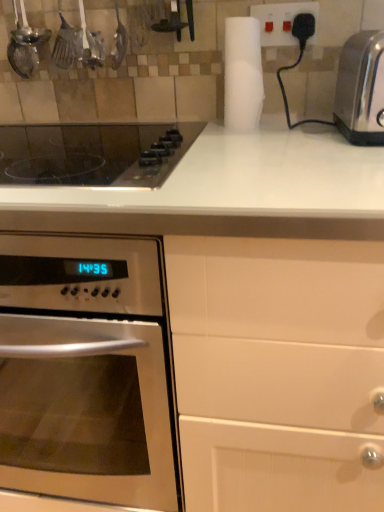
Question: Is satin silver toaster at right to the right of white matte paper towel at upper center from the viewer's perspective?

Choices:
 (A) yes
 (B) no

Answer: (A)

Question: Is satin silver toaster at right positioned far away from white matte paper towel at upper center?

Choices:
 (A) no
 (B) yes

Answer: (A)

Question: Does satin silver toaster at right have a lesser width compared to white matte paper towel at upper center?

Choices:
 (A) yes
 (B) no

Answer: (B)

Question: Is the position of satin silver toaster at right more distant than that of white matte paper towel at upper center?

Choices:
 (A) no
 (B) yes

Answer: (A)

Question: Can you confirm if satin silver toaster at right is shorter than white matte paper towel at upper center?

Choices:
 (A) yes
 (B) no

Answer: (A)

Question: From the image's perspective, relative to white plastic plug at upper right, is satin silver oven at left above or below?

Choices:
 (A) below
 (B) above

Answer: (A)

Question: In the image, is satin silver oven at left positioned in front of or behind white plastic plug at upper right?

Choices:
 (A) behind
 (B) front

Answer: (B)

Question: In the image, is satin silver oven at left on the left side or the right side of white plastic plug at upper right?

Choices:
 (A) right
 (B) left

Answer: (B)

Question: Is satin silver oven at left wider or thinner than white plastic plug at upper right?

Choices:
 (A) wide
 (B) thin

Answer: (A)

Question: Considering the positions of satin silver toaster at right and black glass cooktop at upper left in the image, is satin silver toaster at right wider or thinner than black glass cooktop at upper left?

Choices:
 (A) wide
 (B) thin

Answer: (B)

Question: Is satin silver toaster at right taller or shorter than black glass cooktop at upper left?

Choices:
 (A) short
 (B) tall

Answer: (B)

Question: In terms of size, does satin silver toaster at right appear bigger or smaller than black glass cooktop at upper left?

Choices:
 (A) big
 (B) small

Answer: (B)

Question: Considering their positions, is satin silver toaster at right located in front of or behind black glass cooktop at upper left?

Choices:
 (A) front
 (B) behind

Answer: (B)

Question: Is white plastic plug at upper right in front of or behind white matte paper towel at upper center in the image?

Choices:
 (A) front
 (B) behind

Answer: (B)

Question: From a real-world perspective, relative to white matte paper towel at upper center, is white plastic plug at upper right vertically above or below?

Choices:
 (A) below
 (B) above

Answer: (B)